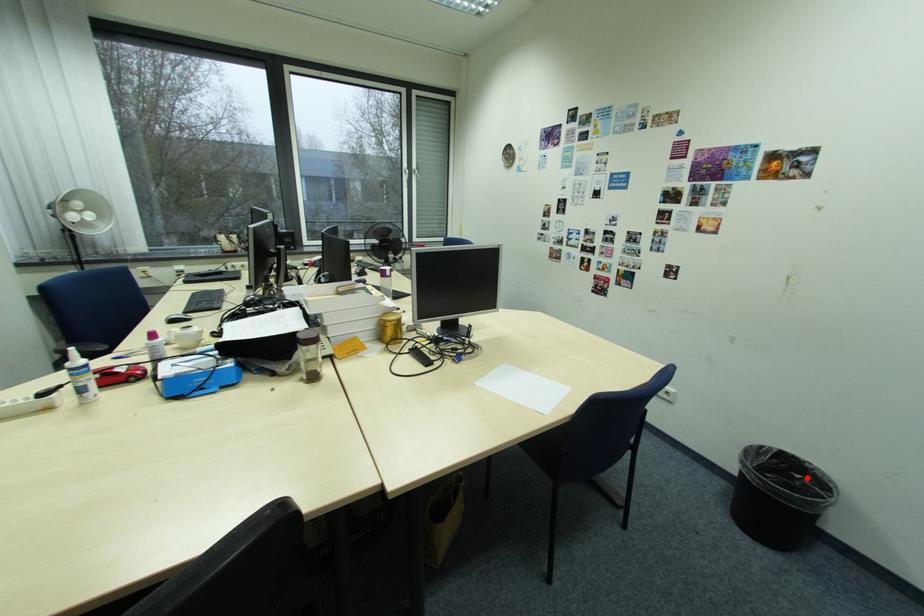
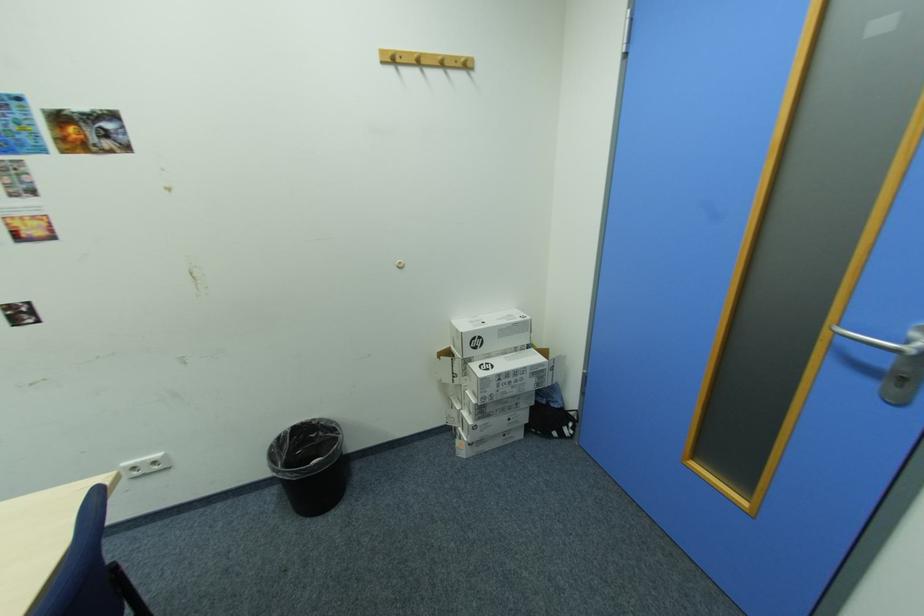
Where in the second image is the point corresponding to the highlighted location from the first image?

(322, 436)